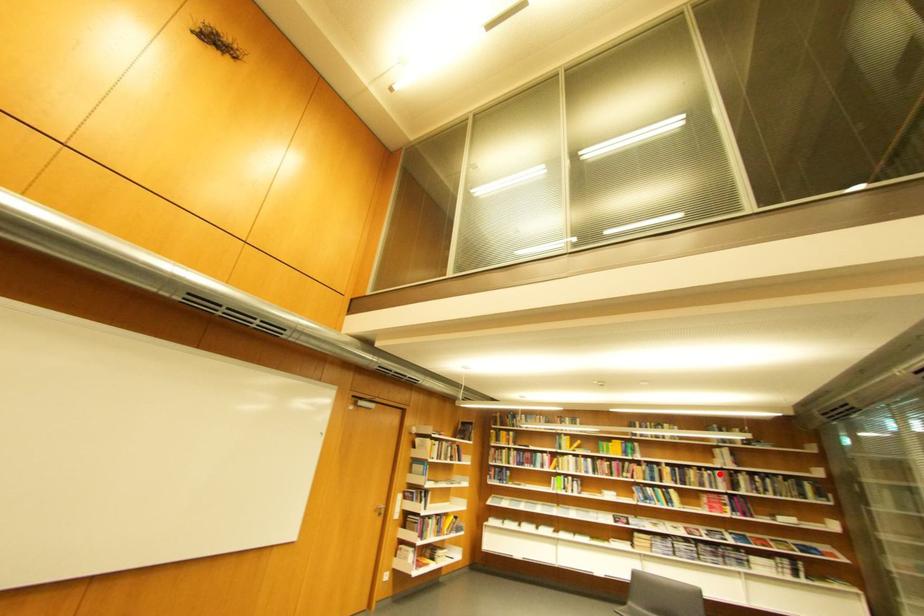
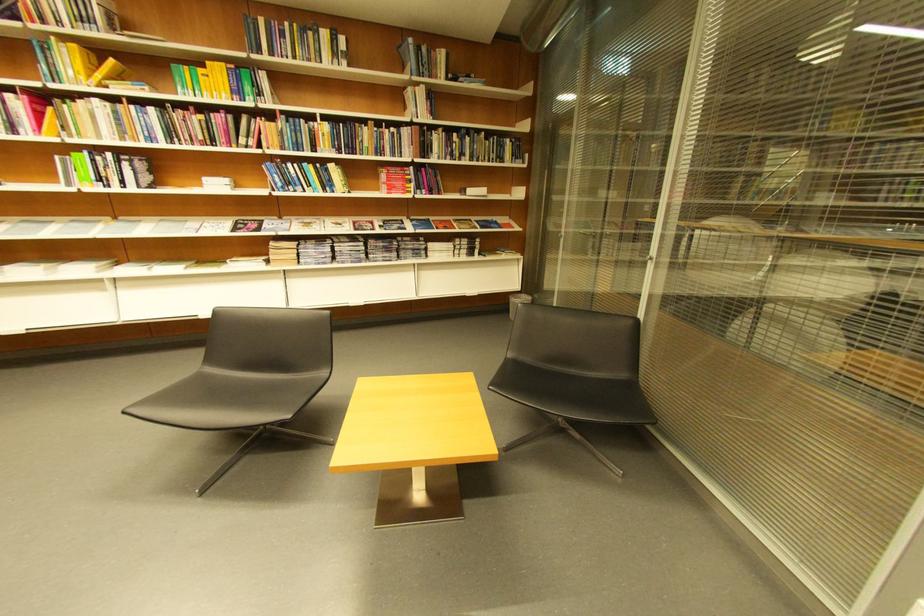
Question: I am providing you with two images of the same scene from different viewpoints. Given a red point in image1, look at the same physical point in image2. Is it:

Choices:
 (A) Closer to the viewpoint
 (B) Farther from the viewpoint

Answer: (A)